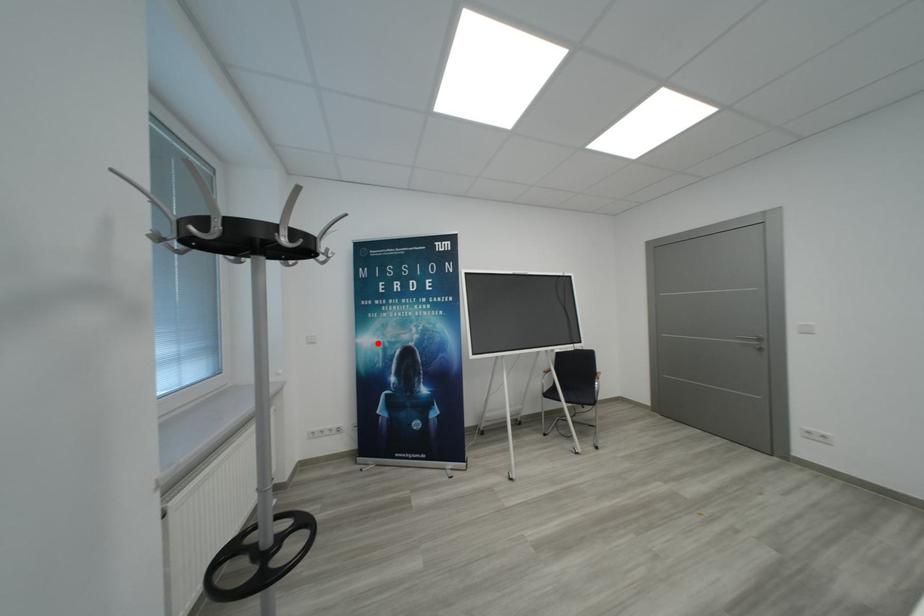
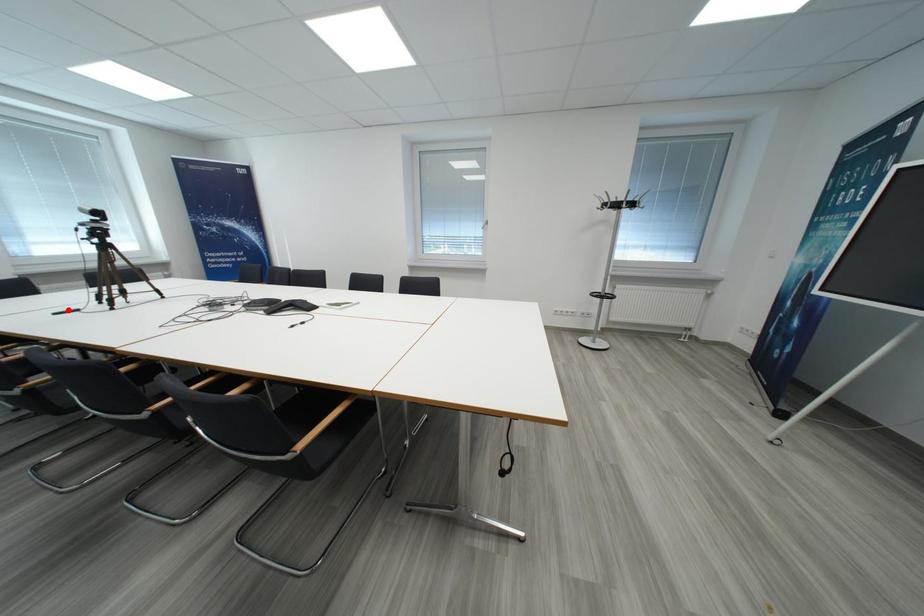
I am providing you with two images of the same scene from different viewpoints. A red point is marked on the first image and another point is marked on the second image. Is the marked point in image1 the same physical position as the marked point in image2?

No